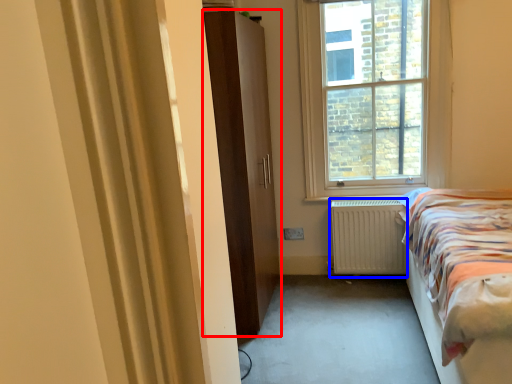
Question: Which point is closer to the camera, door (highlighted by a red box) or radiator (highlighted by a blue box)?

Choices:
 (A) door
 (B) radiator

Answer: (A)